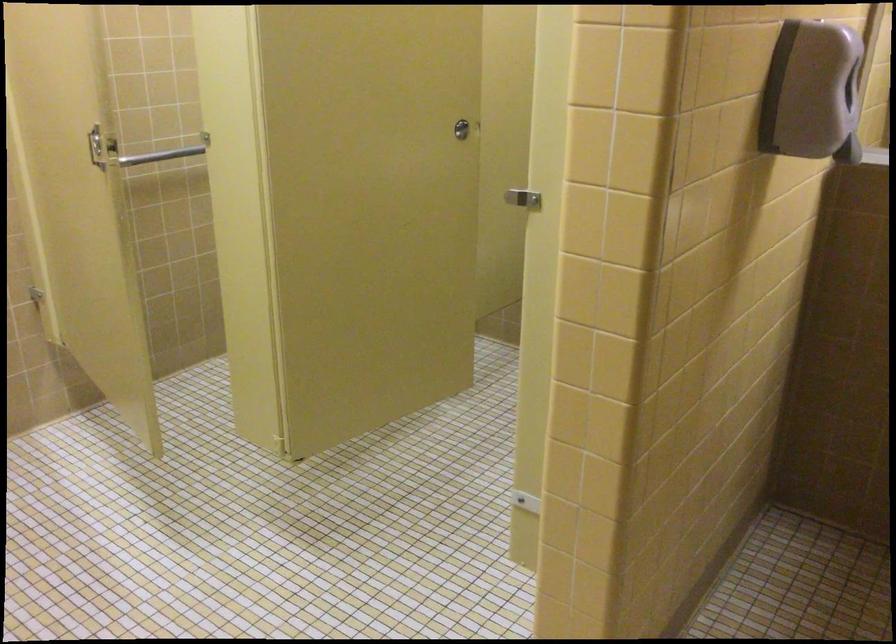
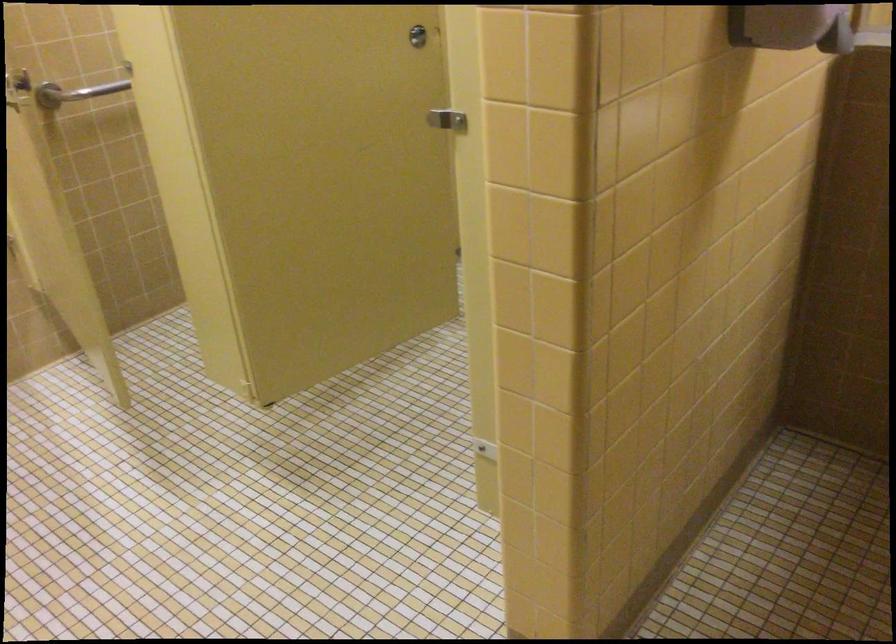
Locate, in the second image, the point that corresponds to point (524, 194) in the first image.

(446, 120)